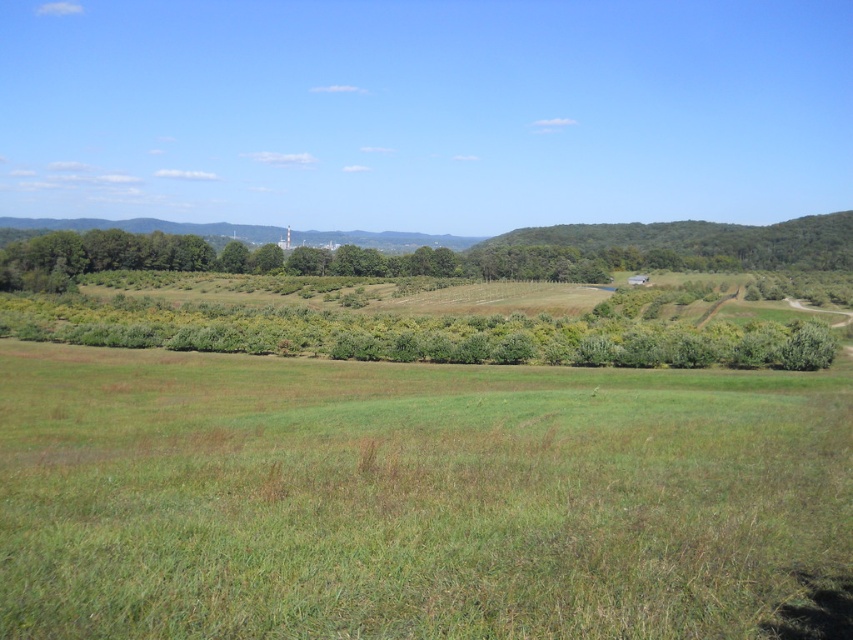
What is the 2D coordinate of the green grassy field at center?

The 2D coordinate of the green grassy field at center is at point (410, 497).

You are a farmer planning to plant new crops in the green grassy field at center and the green leafy trees at center. Based on their positions, which area would receive more sunlight and why?

The green grassy field at center would receive more sunlight because it is positioned under the green leafy trees at center, meaning the trees might be casting shade over the field.